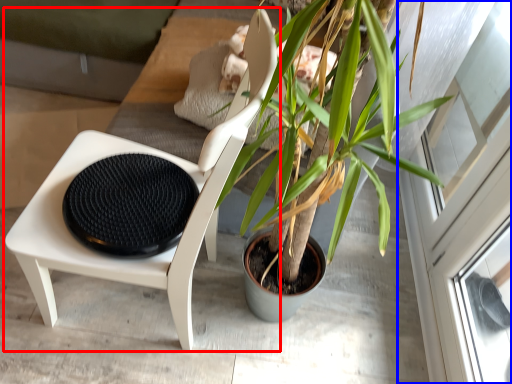
Question: Which point is closer to the camera, chair (highlighted by a red box) or screen door (highlighted by a blue box)?

Choices:
 (A) chair
 (B) screen door

Answer: (A)